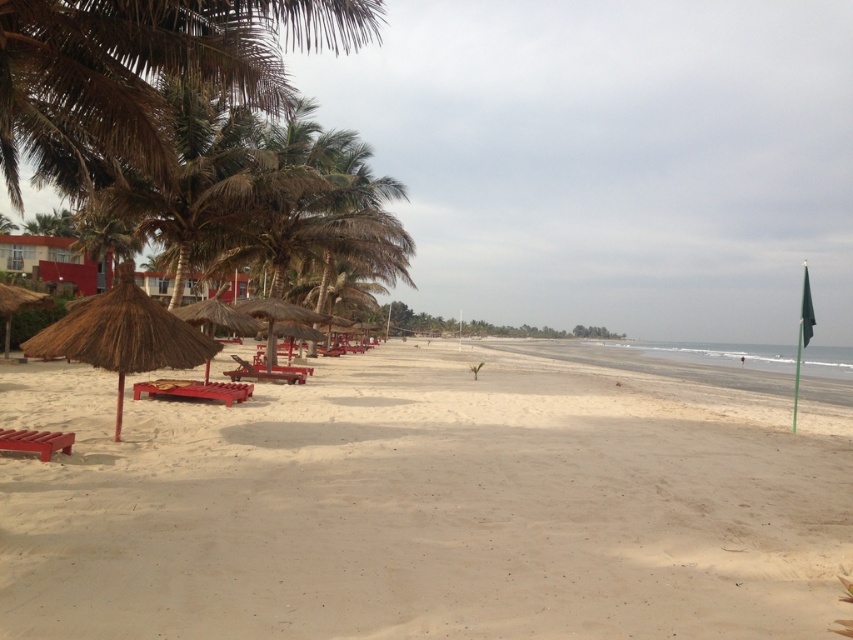
You are standing at the center of the beach and want to locate the thatched straw umbrella at left. Which direction should you look to find it?

You should look to your left to find the thatched straw umbrella at left since it is positioned at the left side of the beach.

You are standing at the center of the beach and want to move towards the beige sandy beach at left. Which direction should you head?

The beige sandy beach at left is located at point 0.784 on the x and 0.509 on the y, so you should head towards the left direction to reach it.